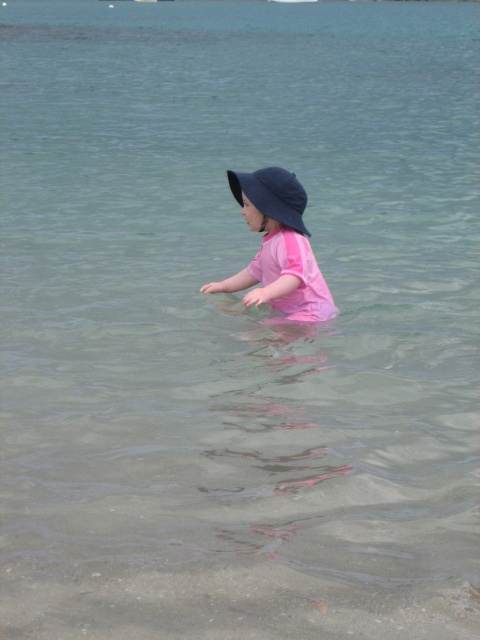
Question: Where is pink matte swimsuit at center located in relation to dark blue fabric hat at center in the image?

Choices:
 (A) below
 (B) above

Answer: (A)

Question: Among these objects, which one is nearest to the camera?

Choices:
 (A) pink matte swimsuit at center
 (B) dark blue fabric hat at center

Answer: (A)

Question: Among these objects, which one is farthest from the camera?

Choices:
 (A) dark blue fabric hat at center
 (B) pink matte swimsuit at center

Answer: (A)

Question: Is pink matte swimsuit at center bigger than dark blue fabric hat at center?

Choices:
 (A) no
 (B) yes

Answer: (B)

Question: Does pink matte swimsuit at center have a larger size compared to dark blue fabric hat at center?

Choices:
 (A) yes
 (B) no

Answer: (A)